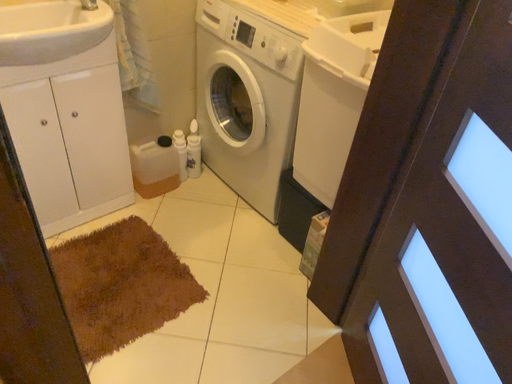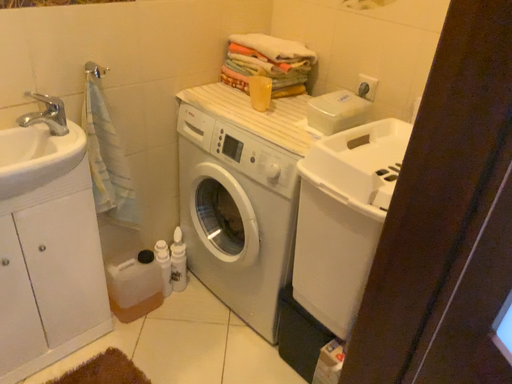
Question: Which way did the camera rotate in the video?

Choices:
 (A) rotated downward
 (B) rotated upward

Answer: (B)